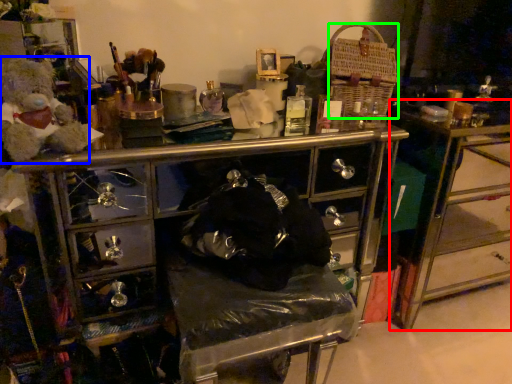
Question: Considering the real-world distances, which object is closest to table (highlighted by a red box)? teddy (highlighted by a blue box) or crate (highlighted by a green box).

Choices:
 (A) teddy
 (B) crate

Answer: (B)